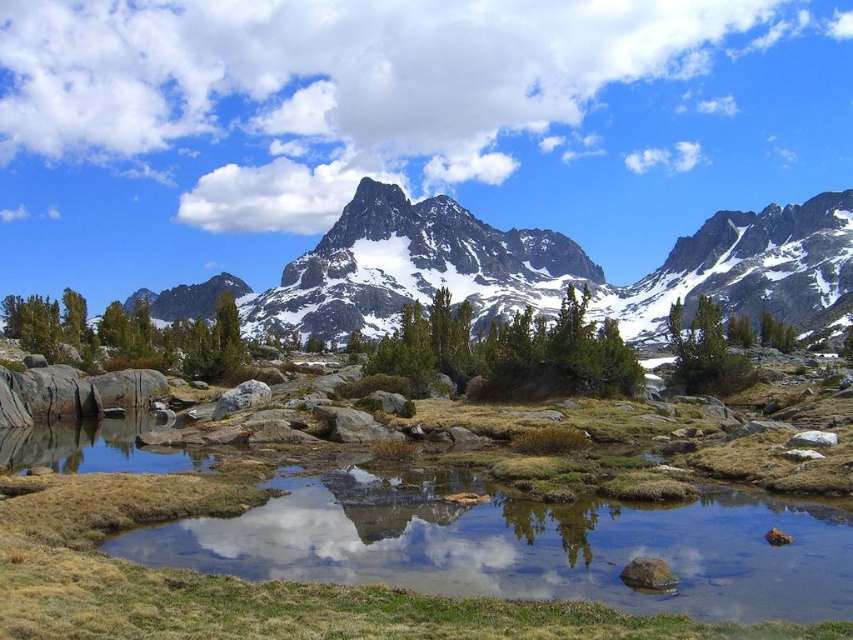
Does clear water at center appear on the left side of green matte tree at center?

Indeed, clear water at center is positioned on the left side of green matte tree at center.

Is point (604, 516) farther from viewer compared to point (717, 348)?

No, it is not.

Image resolution: width=853 pixels, height=640 pixels. I want to click on clear water at center, so click(521, 545).

From the picture: Which is more to the right, green matte shrub at center or green matte tree at center?

green matte tree at center

Does green matte shrub at center appear under green matte tree at center?

Incorrect, green matte shrub at center is not positioned below green matte tree at center.

Where is `green matte shrub at center`? The width and height of the screenshot is (853, 640). green matte shrub at center is located at coordinates (509, 352).

Is white snow-covered mountain range at upper center further to camera compared to green matte shrub at center?

Yes.

Can you confirm if white snow-covered mountain range at upper center is wider than green matte shrub at center?

Yes.

You are a GUI agent. You are given a task and a screenshot of the screen. Output one action in this format:
    pyautogui.click(x=<x>, y=<y>)
    Task: Click on the white snow-covered mountain range at upper center
    
    Given the screenshot: What is the action you would take?
    pyautogui.click(x=532, y=268)